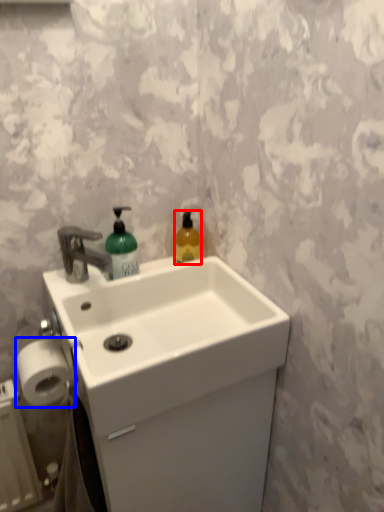
Question: Among these objects, which one is farthest to the camera, bottle (highlighted by a red box) or toilet paper (highlighted by a blue box)?

Choices:
 (A) bottle
 (B) toilet paper

Answer: (A)